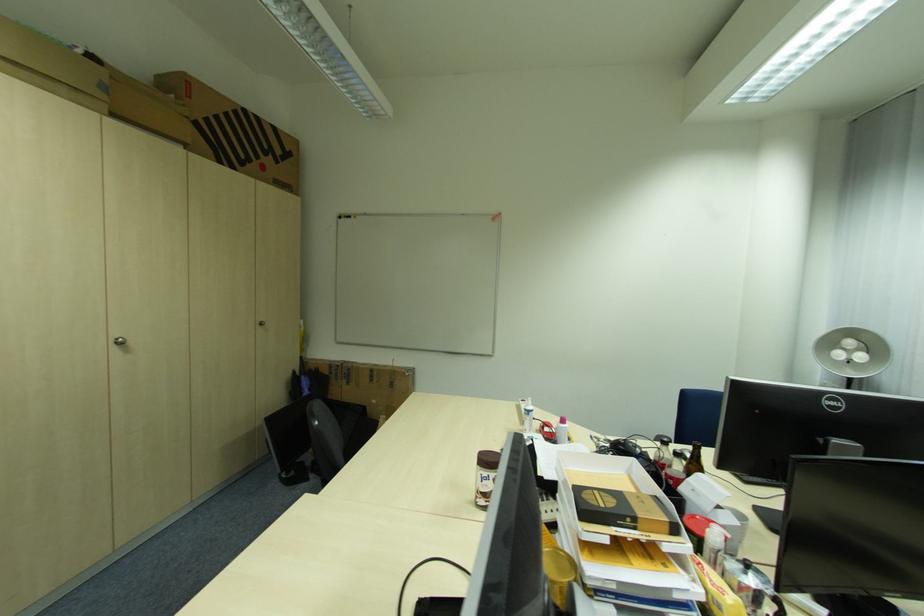
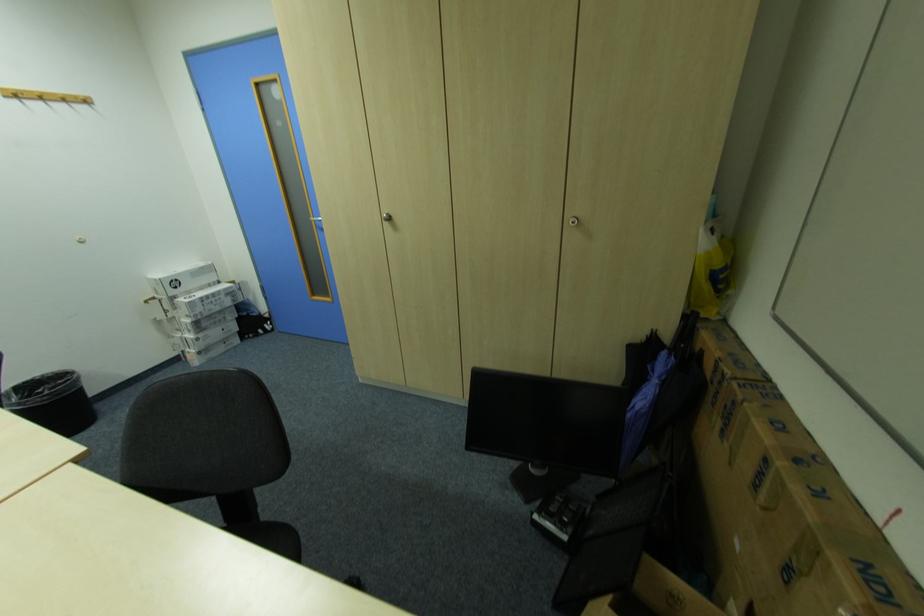
Where in the second image is the point corresponding to (x=384, y=383) from the first image?

(772, 509)